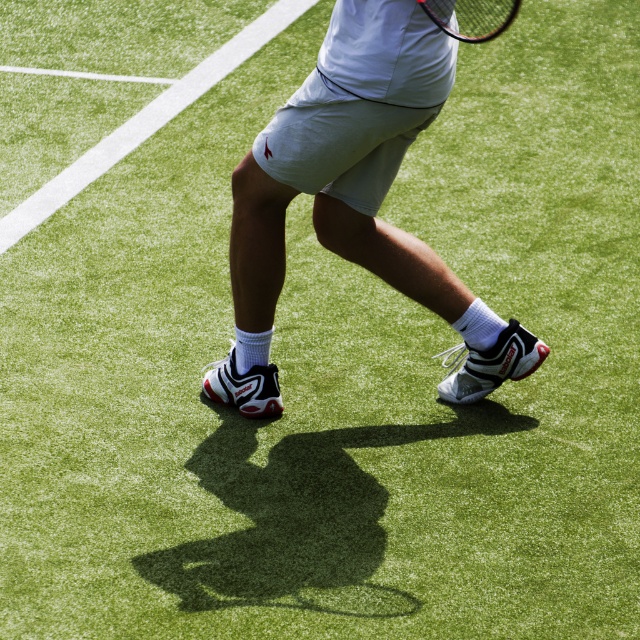
Question: Where is white mesh shorts at center located in relation to black matte tennis racket at upper center in the image?

Choices:
 (A) above
 (B) below

Answer: (B)

Question: Which object is farther from the camera taking this photo?

Choices:
 (A) black matte tennis racket at upper center
 (B) white mesh shorts at center

Answer: (B)

Question: Which point is farther from the camera taking this photo?

Choices:
 (A) (477, 3)
 (B) (442, 305)

Answer: (B)

Question: Is white mesh shorts at center to the left of black matte tennis racket at upper center from the viewer's perspective?

Choices:
 (A) yes
 (B) no

Answer: (A)

Question: Which point appears farthest from the camera in this image?

Choices:
 (A) (237, 301)
 (B) (493, 3)

Answer: (A)

Question: Can you confirm if white mesh shorts at center is wider than black matte tennis racket at upper center?

Choices:
 (A) no
 (B) yes

Answer: (B)